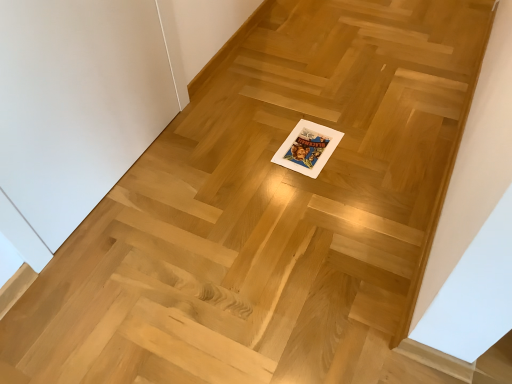
This screenshot has height=384, width=512. Find the location of `white paper at center`. white paper at center is located at coordinates (307, 148).

The width and height of the screenshot is (512, 384). What do you see at coordinates (307, 148) in the screenshot? I see `white paper at center` at bounding box center [307, 148].

Find the location of a particular element. The height and width of the screenshot is (384, 512). white paper at center is located at coordinates (307, 148).